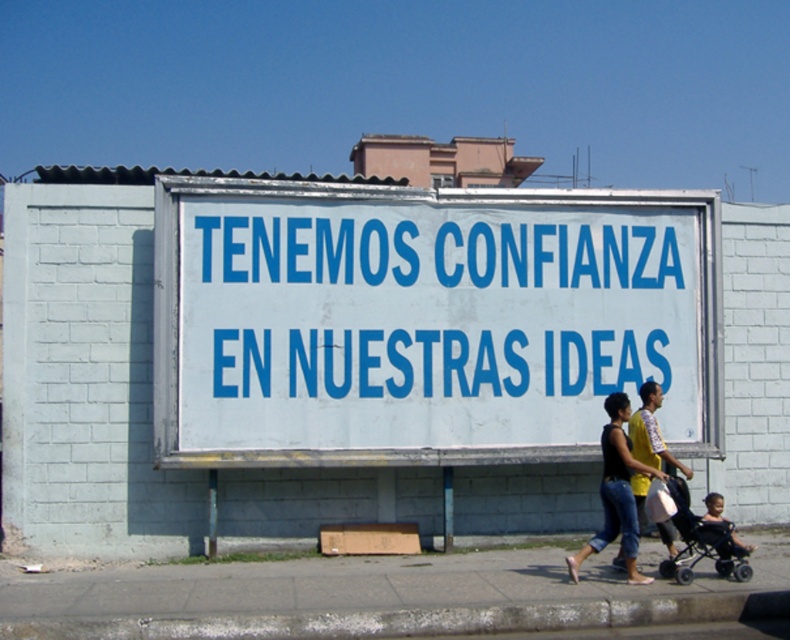
Based on the photo, you are a photographer standing in front of the white paperboard sign at center. You want to take a photo of the sign without including the family walking in front of the wall. Can you step back enough to exclude them from the frame? The camera you are using has a 50mm lens.

The distance between you and the white paperboard sign at center is 8.95 meters. Since the family is in front of the wall, stepping back would allow you to angle the camera to exclude them from the frame while maintaining focus on the sign. The 50mm lens is standard and suitable for this distance, so yes, you can step back and position yourself to exclude the family while capturing the sign.

You are a delivery person who needs to deliver a package to the address on the billboard. You are standing in front of the billboard and see the black denim jeans at lower right and the black plastic baby carriage at lower right. Which object is taller?

The black denim jeans at lower right is much taller than the black plastic baby carriage at lower right.